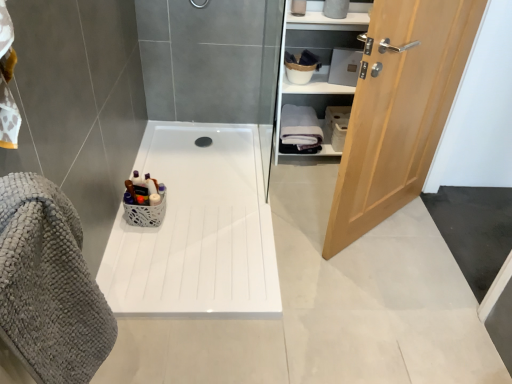
This screenshot has width=512, height=384. Identify the location of vacant space to the right of black rubber drain at center. (229, 139).